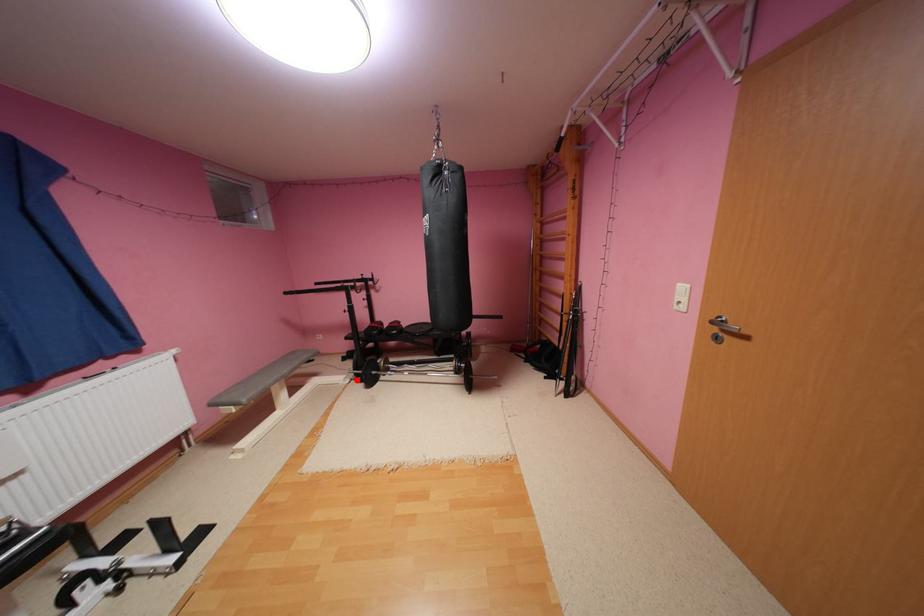
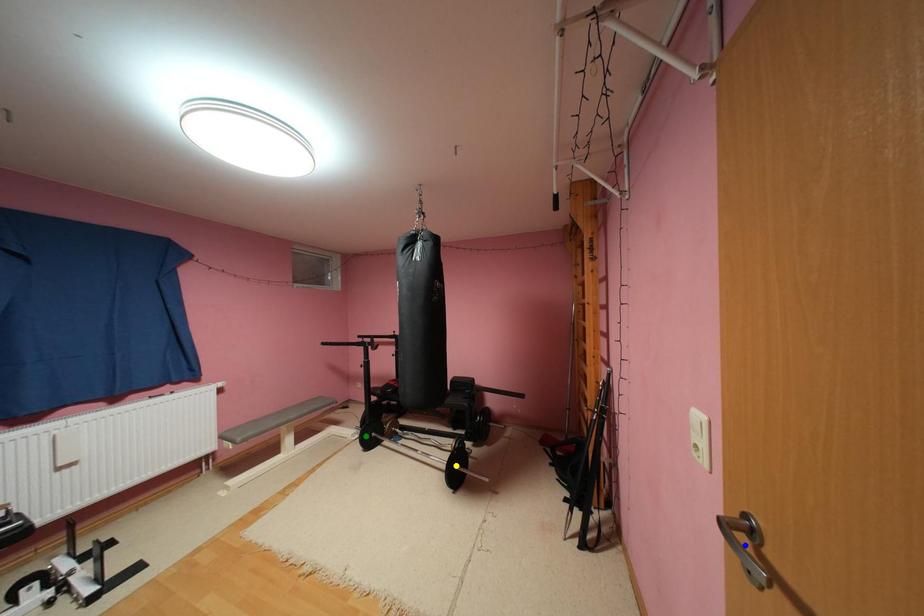
Question: I am providing you with two images of the same scene from different viewpoints. A red point is marked on the first image. You are given multiple points on the second image. Which point in image 2 represents the same 3d spot as the red point in image 1?

Choices:
 (A) yellow point
 (B) green point
 (C) blue point

Answer: (B)